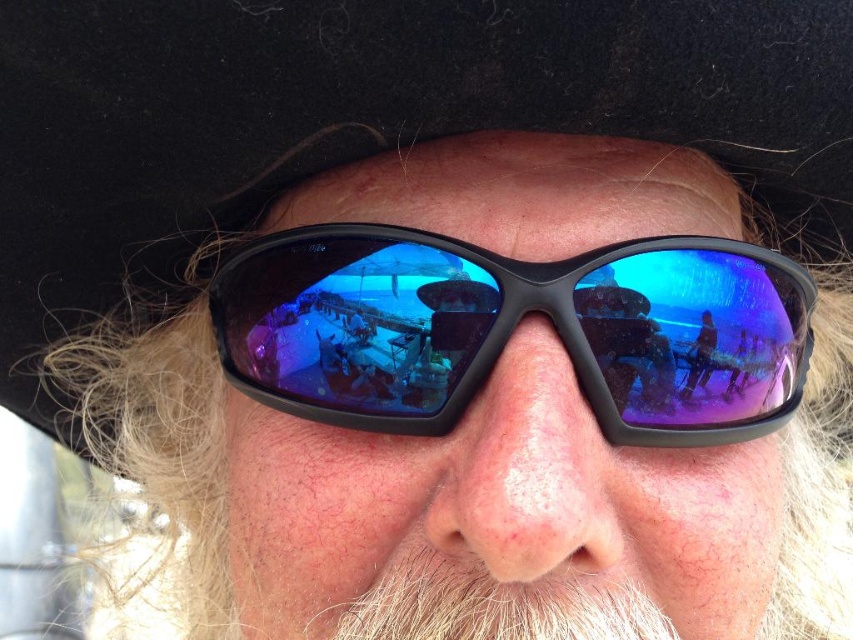
Question: From the image, what is the correct spatial relationship of black felt cowboy hat at upper center in relation to black plastic sunglasses at center?

Choices:
 (A) right
 (B) left

Answer: (B)

Question: Is black felt cowboy hat at upper center further to the viewer compared to black plastic sunglasses at center?

Choices:
 (A) yes
 (B) no

Answer: (B)

Question: Does black felt cowboy hat at upper center appear on the right side of black plastic sunglasses at center?

Choices:
 (A) yes
 (B) no

Answer: (B)

Question: Among these objects, which one is nearest to the camera?

Choices:
 (A) black plastic sunglasses at center
 (B) black felt cowboy hat at upper center

Answer: (B)

Question: Which of the following is the closest to the observer?

Choices:
 (A) (813, 300)
 (B) (86, 116)

Answer: (B)

Question: Which point appears farthest from the camera in this image?

Choices:
 (A) [766, 380]
 (B) [107, 10]

Answer: (A)